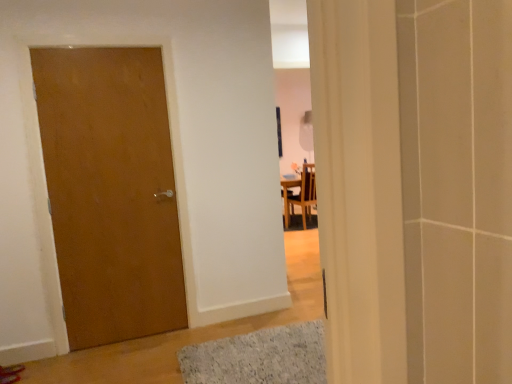
Question: Is matte wood door at left in front of or behind gray textured bath mat at lower center in the image?

Choices:
 (A) front
 (B) behind

Answer: (B)

Question: Based on their sizes in the image, would you say matte wood door at left is bigger or smaller than gray textured bath mat at lower center?

Choices:
 (A) big
 (B) small

Answer: (B)

Question: Which is farther from the matte wood door at left?

Choices:
 (A) gray textured bath mat at lower center
 (B) wooden chair at center

Answer: (B)

Question: Which object is the farthest from the gray textured bath mat at lower center?

Choices:
 (A) matte wood door at left
 (B) wooden chair at center

Answer: (B)